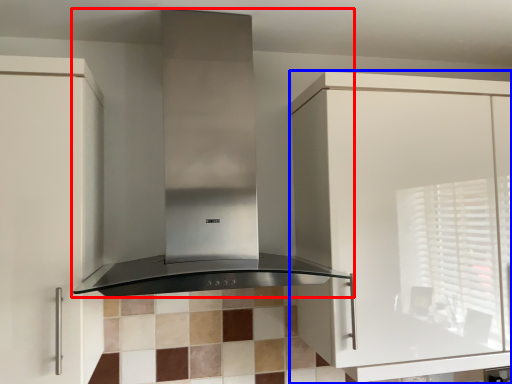
Question: Which of the following is the farthest to the observer, home appliance (highlighted by a red box) or cabinetry (highlighted by a blue box)?

Choices:
 (A) home appliance
 (B) cabinetry

Answer: (B)